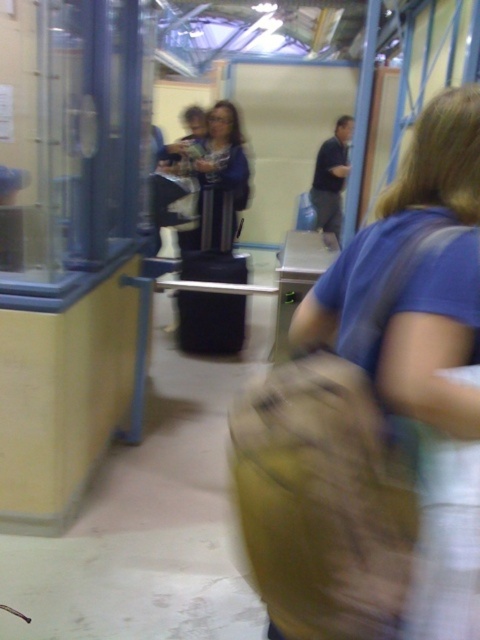
You are an observer at the security checkpoint. You notice a brown fabric bag at center and a blue fabric jacket at center. Which object is located to the right of the other?

The brown fabric bag at center is positioned on the right side of blue fabric jacket at center.

You are an observer in the security checkpoint scene. You notice a brown fabric bag at center and a blue fabric jacket at center. Which object is closer to you?

The brown fabric bag at center is closer to you because it is in front of the blue fabric jacket at center.